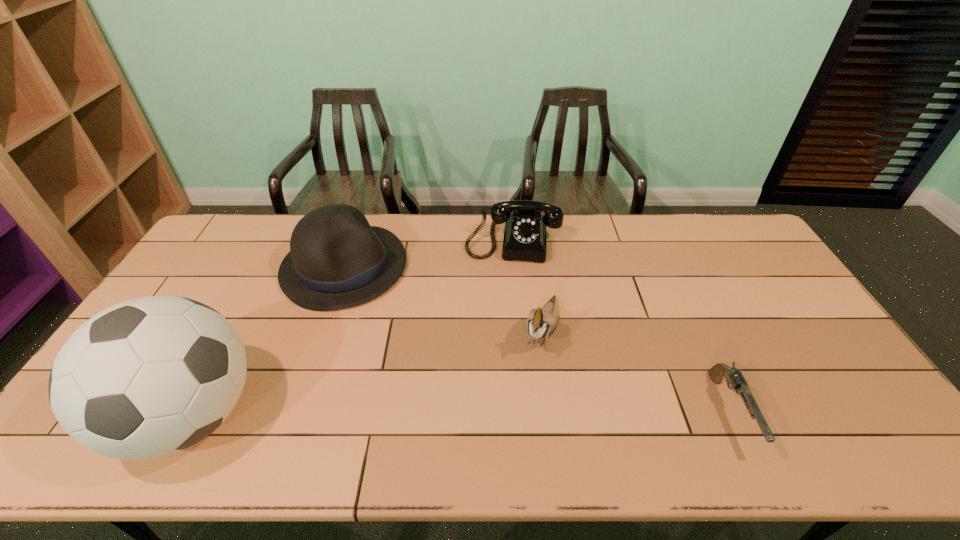
Identify the location of empty space that is in between the gun and the telephone. (621, 325).

At what (x,y) coordinates should I click in order to perform the action: click on free space that is in between the gun and the second shortest object. Please return your answer as a coordinate pair (x, y). Looking at the image, I should click on (621, 325).

Locate an element on the screen. Image resolution: width=960 pixels, height=540 pixels. free area in between the bowler hat and the telephone is located at coordinates (428, 253).

Find the location of a particular element. The width and height of the screenshot is (960, 540). vacant area that lies between the fourth tallest object and the rightmost object is located at coordinates (621, 325).

Locate an element on the screen. This screenshot has height=540, width=960. free spot between the bowler hat and the bird is located at coordinates (443, 299).

Identify the location of object that is the closest to the second shortest object. (541, 323).

Where is `object that is the second closest to the tallest object`? object that is the second closest to the tallest object is located at coordinates (524, 239).

What are the coordinates of `vacant position in the image that satisfies the following two spatial constraints: 1. on the front side of the bird; 2. on the right side of the bowler hat` in the screenshot? It's located at coord(323,330).